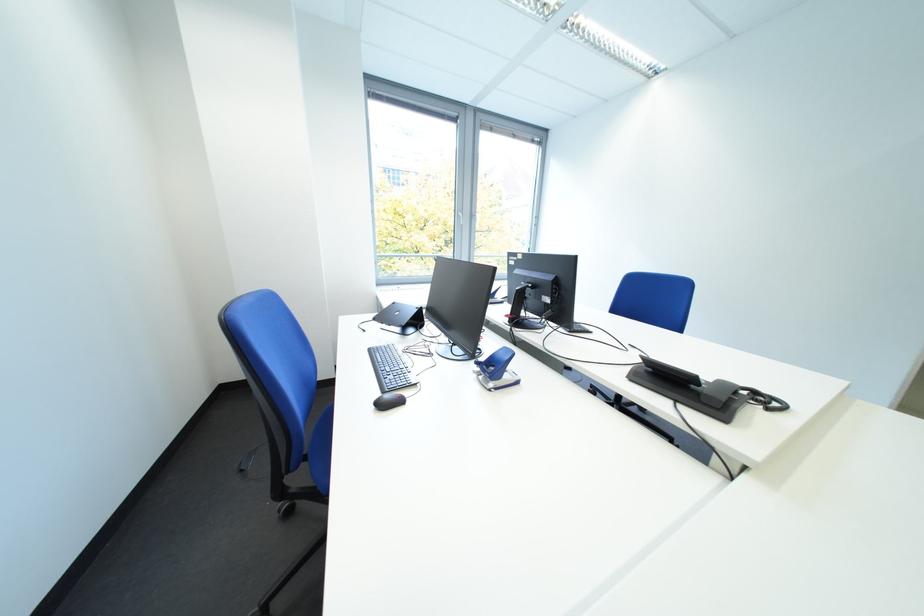
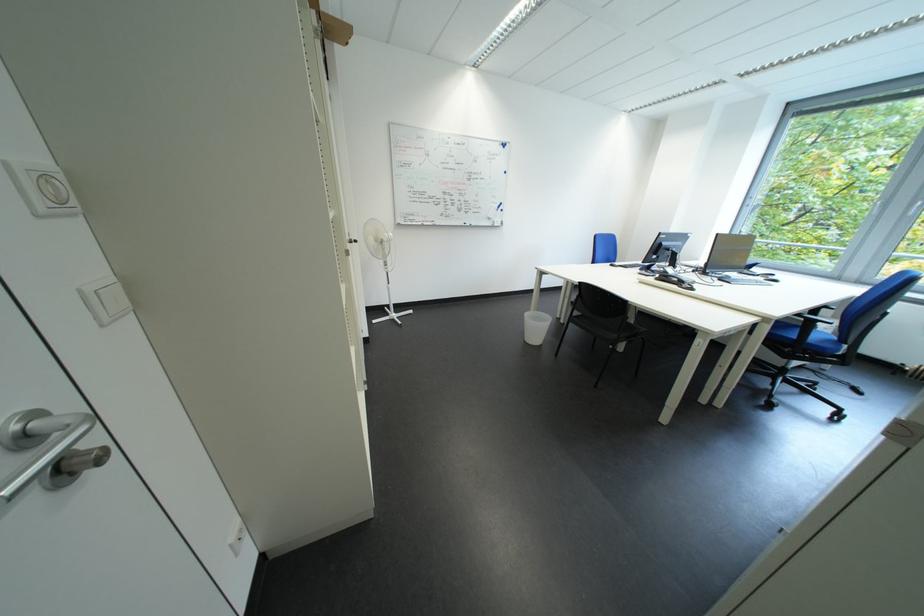
Locate, in the second image, the point that corresponds to (738,424) in the first image.

(669, 282)